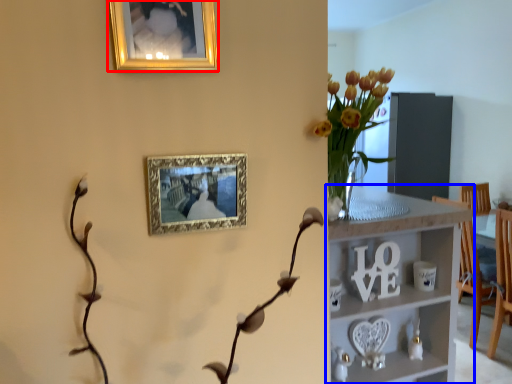
Question: Which object appears farthest to the camera in this image, picture frame (highlighted by a red box) or shelf (highlighted by a blue box)?

Choices:
 (A) picture frame
 (B) shelf

Answer: (B)